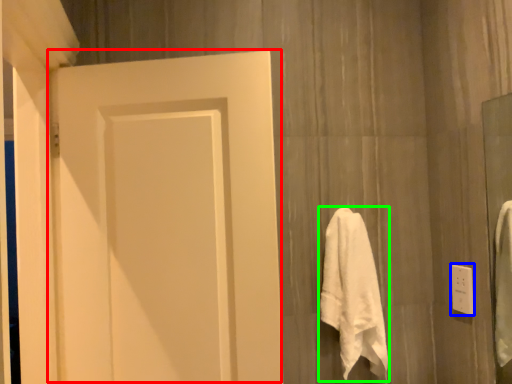
Question: Estimate the real-world distances between objects in this image. Which object is closer to door (highlighted by a red box), electric outlet (highlighted by a blue box) or towel (highlighted by a green box)?

Choices:
 (A) electric outlet
 (B) towel

Answer: (B)